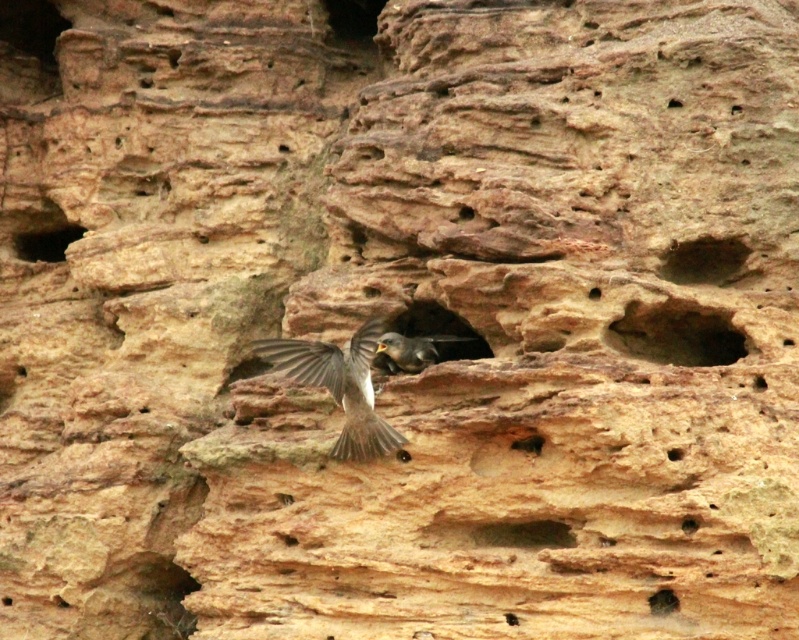
Question: Among these objects, which one is farthest from the camera?

Choices:
 (A) brown matte bird at center
 (B) smooth rock hole at upper right
 (C) smooth brown rock at center right
 (D) smooth brown rock at center

Answer: (A)

Question: Is brown speckled feathers at center wider than smooth brown rock at center?

Choices:
 (A) no
 (B) yes

Answer: (B)

Question: Can you confirm if smooth rock hole at upper right is positioned above smooth brown rock at center?

Choices:
 (A) no
 (B) yes

Answer: (B)

Question: Can you confirm if smooth brown rock at center right is positioned above smooth brown rock at center?

Choices:
 (A) no
 (B) yes

Answer: (B)

Question: Which of the following is the closest to the observer?

Choices:
 (A) smooth rock hole at upper left
 (B) smooth dark brown hole at lower right

Answer: (B)

Question: Which object is the closest to the brown speckled feathers at center?

Choices:
 (A) smooth brown rock at center
 (B) smooth rock hole at upper right

Answer: (A)